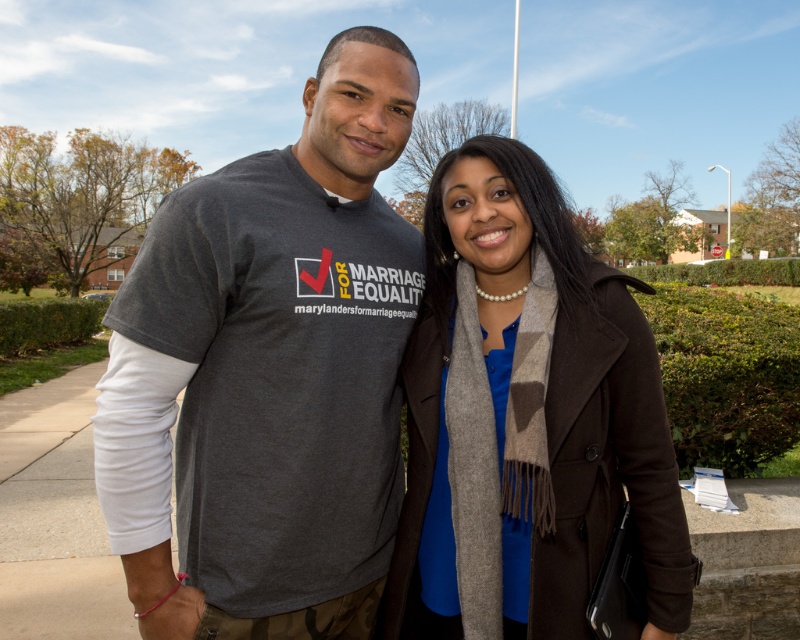
Which is behind, point (310, 131) or point (642, 422)?

Positioned behind is point (310, 131).

Which is more to the right, dark gray t-shirt at center or blue wool scarf at center?

From the viewer's perspective, blue wool scarf at center appears more on the right side.

The width and height of the screenshot is (800, 640). Find the location of `dark gray t-shirt at center`. dark gray t-shirt at center is located at coordinates (280, 365).